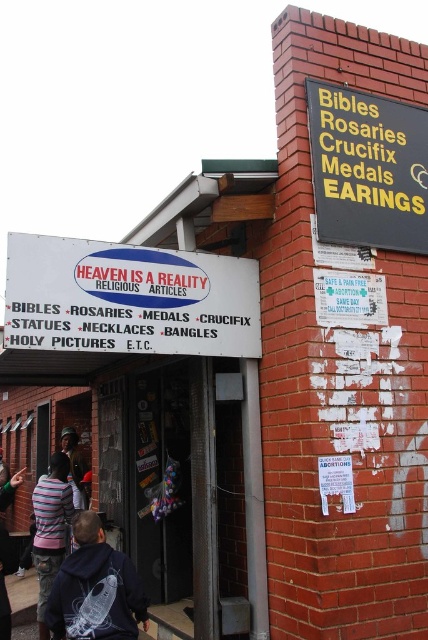
Question: Estimate the real-world distances between objects in this image. Which object is farther from the dark blue hoodie at lower left?

Choices:
 (A) yellow plastic sign at upper right
 (B) striped sweater at lower left
 (C) striped fabric jacket at lower left
 (D) white paper sign at center

Answer: (B)

Question: Can you confirm if dark blue hoodie at lower left is positioned below striped fabric jacket at lower left?

Choices:
 (A) yes
 (B) no

Answer: (B)

Question: Considering the relative positions of dark blue hoodie at lower left and white paper sign at center in the image provided, where is dark blue hoodie at lower left located with respect to white paper sign at center?

Choices:
 (A) right
 (B) left

Answer: (B)

Question: Is the position of striped fabric jacket at lower left less distant than that of white paper sign at center?

Choices:
 (A) no
 (B) yes

Answer: (A)

Question: Which is nearer to the dark blue hoodie at lower left?

Choices:
 (A) striped fabric jacket at lower left
 (B) white paper sign at center
 (C) yellow plastic sign at upper right

Answer: (B)

Question: Which is farther from the striped fabric jacket at lower left?

Choices:
 (A) white paper sign at center
 (B) striped sweater at lower left
 (C) dark blue hoodie at lower left

Answer: (A)